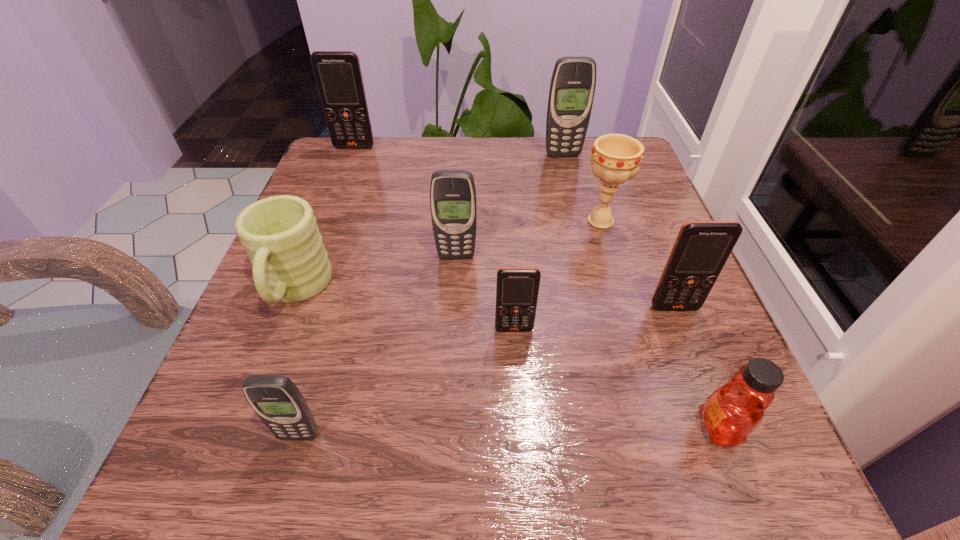
The image size is (960, 540). In order to click on the second orange cellular telephone from right to left in this screenshot , I will do `click(517, 288)`.

This screenshot has width=960, height=540. Find the location of `the smallest orange cellular telephone`. the smallest orange cellular telephone is located at coordinates (517, 288).

Locate an element on the screen. The width and height of the screenshot is (960, 540). the smallest gray cellular telephone is located at coordinates (277, 401).

Where is `the nearest cellular telephone`? the nearest cellular telephone is located at coordinates (277, 401).

Find the location of a particular element. This screenshot has height=540, width=960. honey is located at coordinates (733, 411).

Identify the location of free region located on the screen of the farthest object. click(x=345, y=173).

Locate an element on the screen. blank space located 0.270m on the screen of the second cellular telephone from right to left is located at coordinates (581, 231).

Identify the location of free space located 0.300m on the screen of the fourth nearest cellular telephone. (447, 412).

Locate an element on the screen. This screenshot has height=540, width=960. free location located on the screen of the fourth farthest cellular telephone is located at coordinates (723, 429).

Find the location of `vacant space located on the front of the chalice`. vacant space located on the front of the chalice is located at coordinates (625, 302).